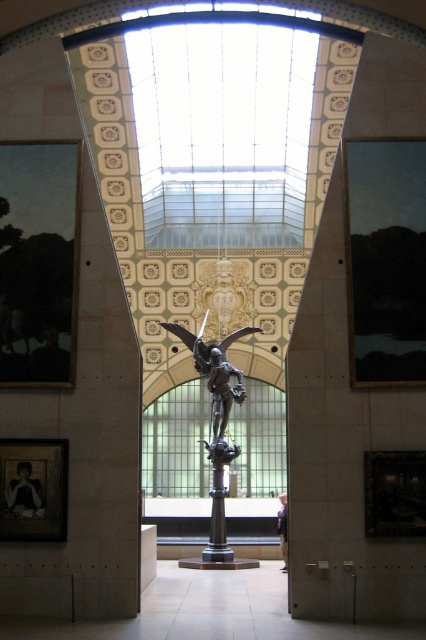
You are an art curator assessing the museum layout. You need to determine which painting is taller between the matte black painting at left and the dark matte painting at right. Based on the scene description, which one is taller?

The matte black painting at left is taller than the dark matte painting at right according to the description.

You are an art curator arranging a temporary exhibition in the museum. You need to hang a new painting that requires a frame exactly the same height as the wooden picture frame at lower right. Based on the scene, can you determine if the matte black picture frame at lower left can be used as a reference for the new frame height?

The matte black picture frame at lower left is above the wooden picture frame at lower right, but their heights are not compared in the description. Therefore, you cannot determine if the matte black picture frame at lower left can be used as a reference for the new frame height required for the wooden picture frame at lower right.